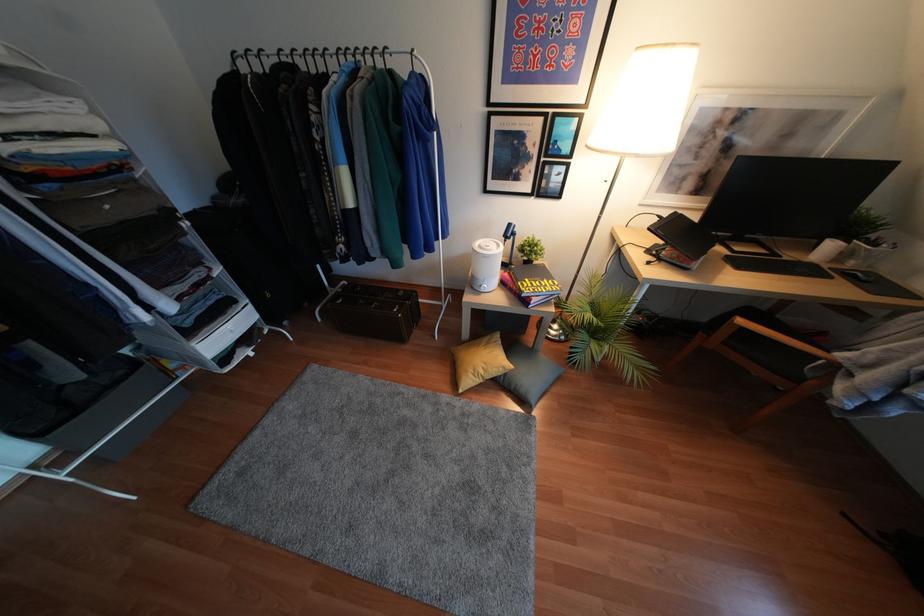
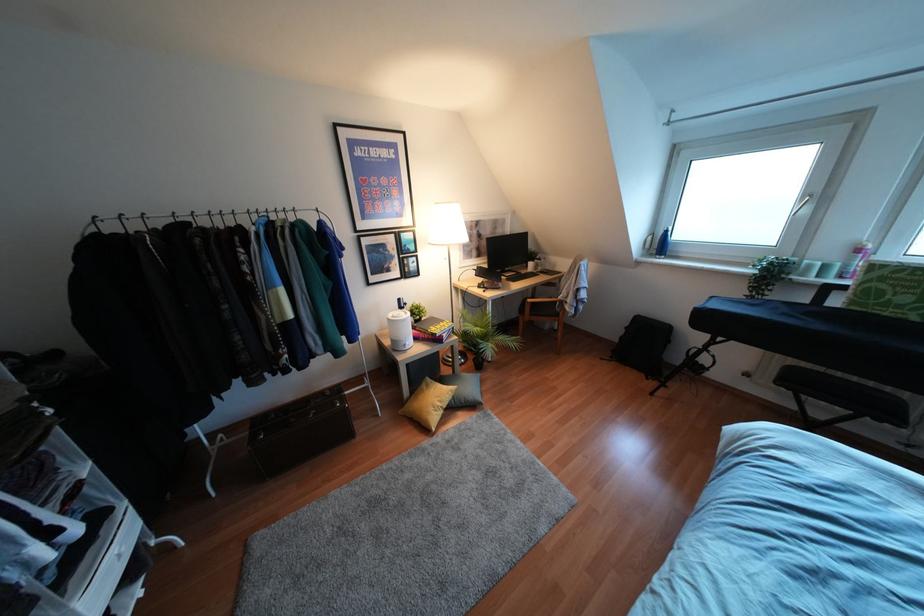
Locate, in the second image, the point that corresponds to point (505, 374) in the first image.

(453, 397)